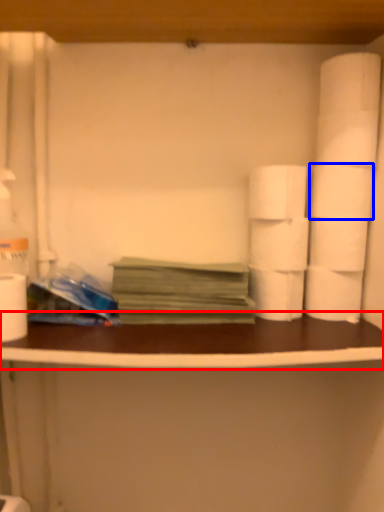
Question: Which point is closer to the camera, counter top (highlighted by a red box) or toilet paper (highlighted by a blue box)?

Choices:
 (A) counter top
 (B) toilet paper

Answer: (A)